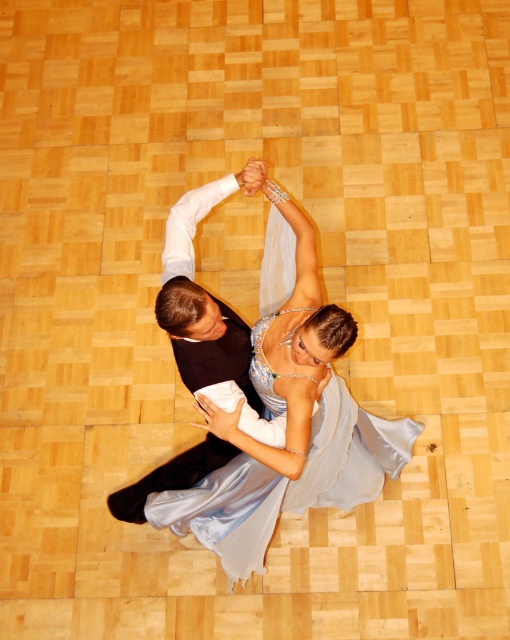
This screenshot has height=640, width=510. In order to click on satin dress at center in this screenshot , I will do `click(271, 403)`.

Describe the element at coordinates (271, 403) in the screenshot. I see `satin dress at center` at that location.

This screenshot has height=640, width=510. I want to click on satin dress at center, so click(x=271, y=403).